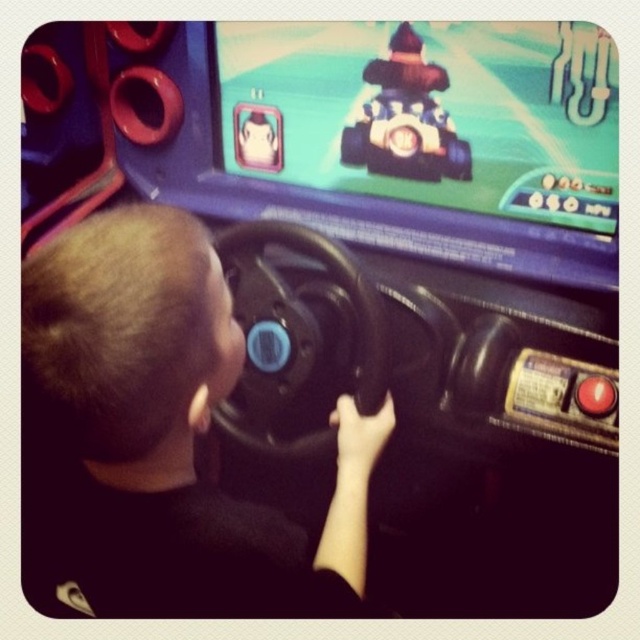
Is black matte steering wheel at center above black plastic steering wheel at center?

No.

Is black matte steering wheel at center bigger than black plastic steering wheel at center?

Yes.

Does point (202, 541) come farther from viewer compared to point (248, 225)?

That is False.

Locate an element on the screen. black matte steering wheel at center is located at coordinates (163, 435).

Can you confirm if black matte steering wheel at center is smaller than shiny blue plastic toy car at center?

No.

Based on the photo, who is higher up, black matte steering wheel at center or shiny blue plastic toy car at center?

shiny blue plastic toy car at center is higher up.

What are the coordinates of `black matte steering wheel at center` in the screenshot? It's located at (163, 435).

Can you confirm if black plastic steering wheel at center is thinner than shiny blue plastic toy car at center?

No, black plastic steering wheel at center is not thinner than shiny blue plastic toy car at center.

Is black plastic steering wheel at center to the left of shiny blue plastic toy car at center from the viewer's perspective?

Indeed, black plastic steering wheel at center is positioned on the left side of shiny blue plastic toy car at center.

Is point (244, 390) behind point (368, 120)?

That is False.

Find the location of a particular element. The width and height of the screenshot is (640, 640). black plastic steering wheel at center is located at coordinates (292, 337).